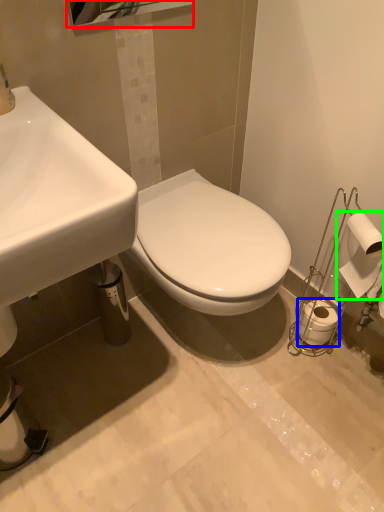
Question: Which is farther away from mirror (highlighted by a red box)? toilet paper (highlighted by a blue box) or toilet paper (highlighted by a green box)?

Choices:
 (A) toilet paper
 (B) toilet paper

Answer: (A)